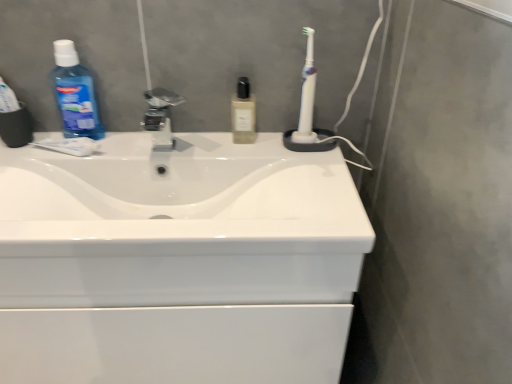
The height and width of the screenshot is (384, 512). In order to click on vacant area that lies between translucent glass bottle at center and satin nickel faucet at center in this screenshot , I will do `click(204, 137)`.